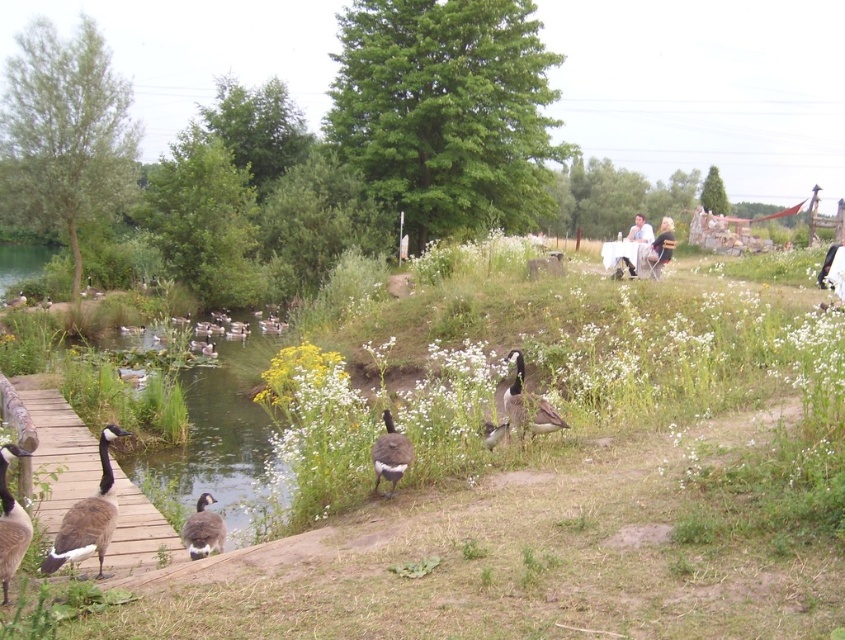
Question: Can you confirm if brown fuzzy duck at center is positioned below white matte duck at center?

Choices:
 (A) no
 (B) yes

Answer: (B)

Question: Is brown feathered goose at lower left to the left of gray matte duck at lower left from the viewer's perspective?

Choices:
 (A) yes
 (B) no

Answer: (A)

Question: Can you confirm if brown feathered duck at left is positioned below gray matte duck at lower left?

Choices:
 (A) yes
 (B) no

Answer: (B)

Question: Which of the following is the farthest from the observer?

Choices:
 (A) white matte duck at center
 (B) white downy goose at center

Answer: (A)

Question: Which is nearer to the brown fuzzy duck at center?

Choices:
 (A) green grassy water at left
 (B) light brown fabric chair at center right
 (C) brown feathered duck at left

Answer: (C)

Question: Which point is closer to the camera?

Choices:
 (A) brown feathered geese at lower left
 (B) light brown fabric chair at center right
 (C) green grassy water at left
 (D) brown fuzzy duck at center

Answer: (A)